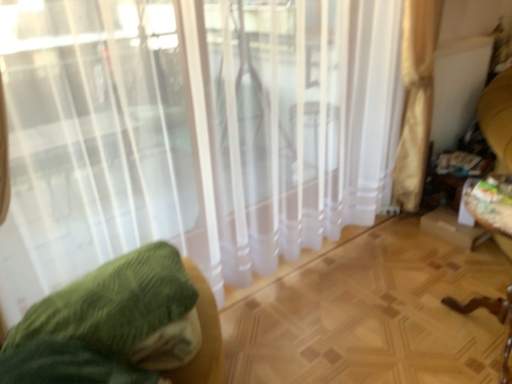
Question: Choose the correct answer: Is wooden swivel chair at right inside green fabric cushion at left or outside it?

Choices:
 (A) inside
 (B) outside

Answer: (B)

Question: From their relative heights in the image, would you say wooden swivel chair at right is taller or shorter than green fabric cushion at left?

Choices:
 (A) tall
 (B) short

Answer: (A)

Question: Which object is the farthest from the green fabric cushion at left?

Choices:
 (A) white sheer curtain at center
 (B) wooden swivel chair at right

Answer: (B)

Question: Which object is the closest to the green fabric cushion at left?

Choices:
 (A) white sheer curtain at center
 (B) wooden swivel chair at right

Answer: (A)